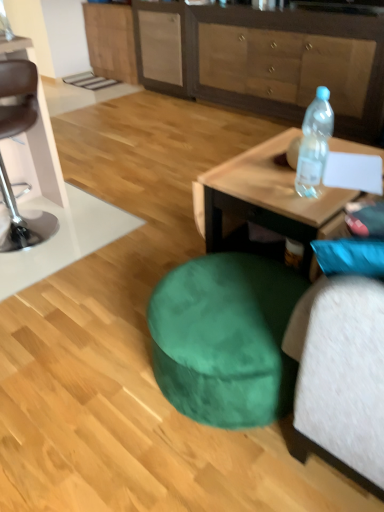
Identify the location of vacant area situated to the left side of wooden cabinet at upper center, which is the 1th cabinetry in right-to-left order. (166, 128).